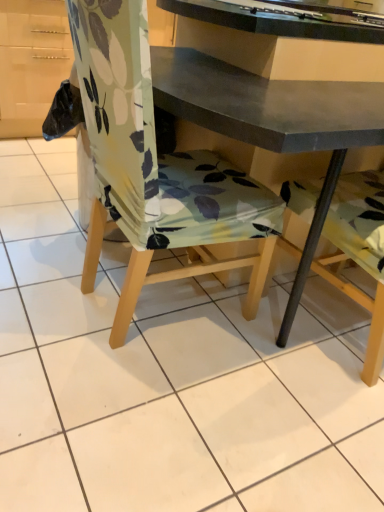
Question: In terms of height, does matte gray desk at center look taller or shorter compared to floral fabric chair at center?

Choices:
 (A) short
 (B) tall

Answer: (B)

Question: From a real-world perspective, is matte gray desk at center physically located above or below floral fabric chair at center?

Choices:
 (A) below
 (B) above

Answer: (B)

Question: Do you think matte gray desk at center is within floral fabric chair at center, or outside of it?

Choices:
 (A) outside
 (B) inside

Answer: (A)

Question: In the image, is floral fabric chair at center positioned in front of or behind matte gray desk at center?

Choices:
 (A) front
 (B) behind

Answer: (A)

Question: Is floral fabric chair at center situated inside matte gray desk at center or outside?

Choices:
 (A) outside
 (B) inside

Answer: (A)

Question: Is floral fabric chair at center bigger or smaller than matte gray desk at center?

Choices:
 (A) small
 (B) big

Answer: (B)

Question: Does point (203, 209) appear closer or farther from the camera than point (193, 56)?

Choices:
 (A) farther
 (B) closer

Answer: (B)